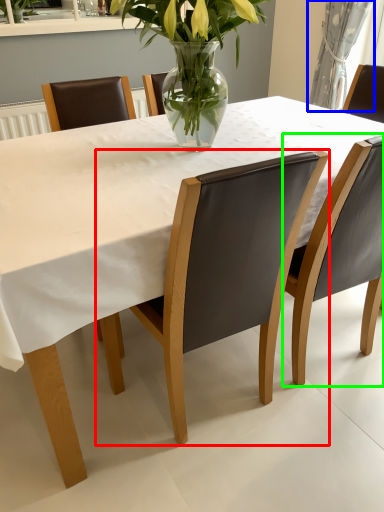
Question: Based on their relative distances, which object is farther from chair (highlighted by a red box)? Choose from curtain (highlighted by a blue box) and chair (highlighted by a green box).

Choices:
 (A) curtain
 (B) chair

Answer: (A)